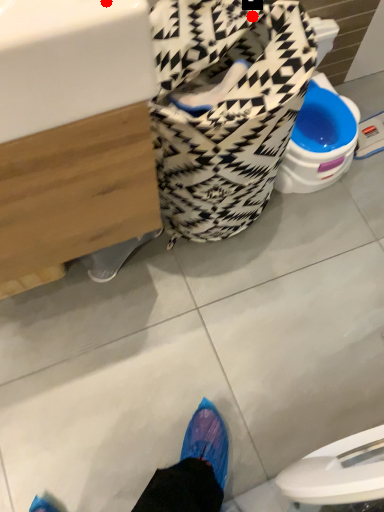
Question: Two points are circled on the image, labeled by A and B beside each circle. Which point is closer to the camera taking this photo?

Choices:
 (A) A is closer
 (B) B is closer

Answer: (A)